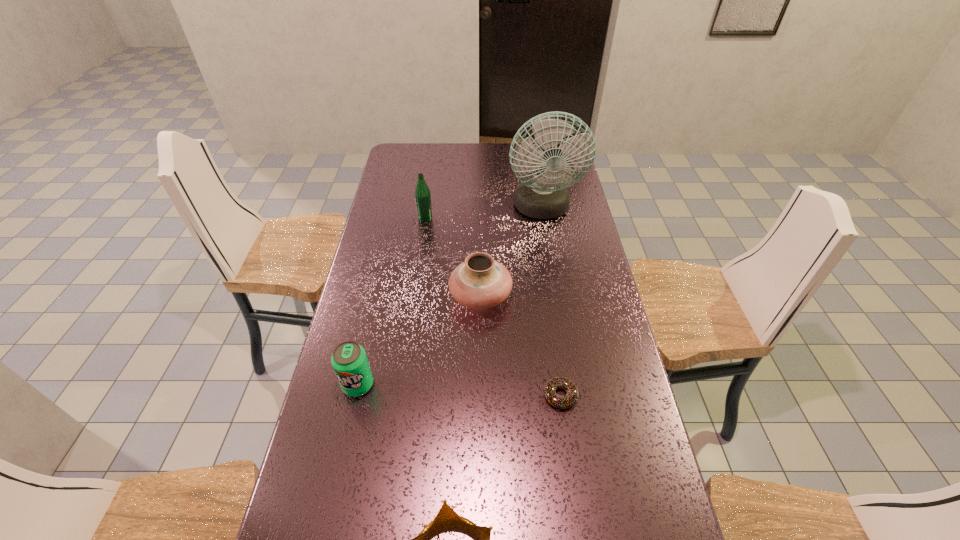
The width and height of the screenshot is (960, 540). I want to click on the tallest object, so click(x=545, y=196).

You are a GUI agent. You are given a task and a screenshot of the screen. Output one action in this format:
    pyautogui.click(x=<x>, y=<y>)
    Task: Click on the bottle
    
    Given the screenshot: What is the action you would take?
    pyautogui.click(x=422, y=193)

At what (x,y) coordinates should I click in order to perform the action: click on the fifth shortest object. Please return your answer as a coordinate pair (x, y). This screenshot has width=960, height=540. Looking at the image, I should click on (422, 193).

You are a GUI agent. You are given a task and a screenshot of the screen. Output one action in this format:
    pyautogui.click(x=<x>, y=<y>)
    Task: Click on the pottery
    
    Given the screenshot: What is the action you would take?
    pyautogui.click(x=479, y=282)

Identify the location of the leftmost object. The width and height of the screenshot is (960, 540). (349, 360).

The width and height of the screenshot is (960, 540). What are the coordinates of `doughnut` in the screenshot? It's located at (570, 399).

Where is `free spot located in front of the fan where the airflow is directed`? The image size is (960, 540). free spot located in front of the fan where the airflow is directed is located at coordinates (547, 241).

The width and height of the screenshot is (960, 540). Find the location of `vacant space situated 0.270m on the right of the second tallest object`. vacant space situated 0.270m on the right of the second tallest object is located at coordinates (502, 219).

Locate an element on the screen. The width and height of the screenshot is (960, 540). free space located 0.150m on the back of the third farthest object is located at coordinates (480, 246).

Find the location of a particular element. This screenshot has height=540, width=960. vacant region located on the front-facing side of the leftmost object is located at coordinates tap(351, 416).